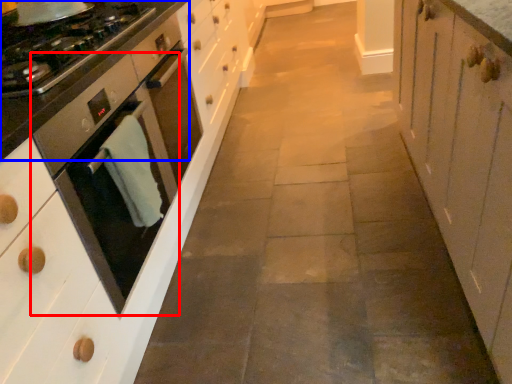
Question: Which object is further to the camera taking this photo, home appliance (highlighted by a red box) or countertop (highlighted by a blue box)?

Choices:
 (A) home appliance
 (B) countertop

Answer: (B)